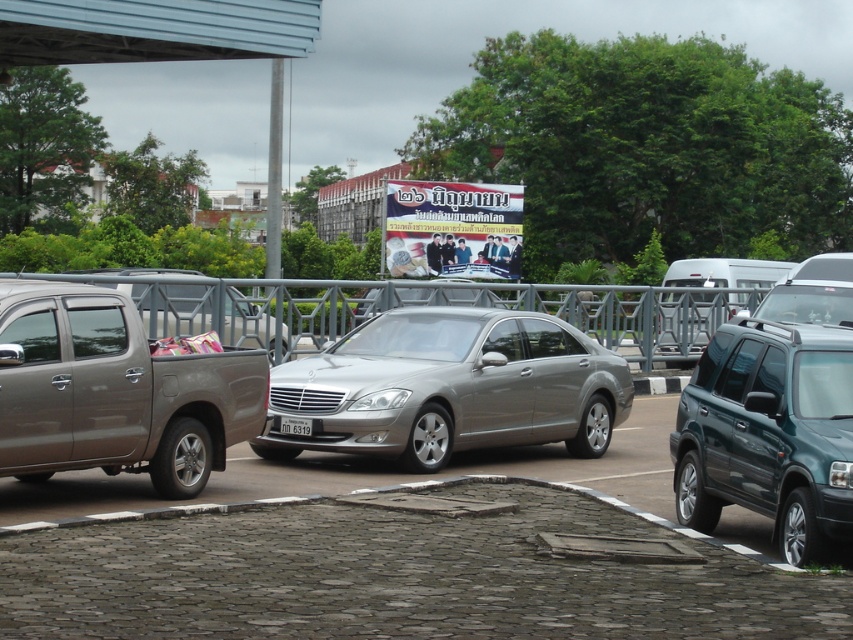
From the picture: Between satin silver sedan at center and matte metallic truck at left, which one appears on the left side from the viewer's perspective?

Positioned to the left is matte metallic truck at left.

Does satin silver sedan at center appear on the right side of matte metallic truck at left?

Correct, you'll find satin silver sedan at center to the right of matte metallic truck at left.

Between point (518, 317) and point (79, 417), which one is positioned in front?

Point (79, 417)

This screenshot has height=640, width=853. Find the location of `satin silver sedan at center`. satin silver sedan at center is located at coordinates (450, 387).

Who is lower down, satin silver sedan at center or metallic green suv at right?

metallic green suv at right is lower down.

Is the position of satin silver sedan at center less distant than that of metallic green suv at right?

No.

Where is `satin silver sedan at center`? satin silver sedan at center is located at coordinates (450, 387).

How distant is metallic green suv at right from white plastic license plate at center?

metallic green suv at right is 4.43 meters from white plastic license plate at center.

Describe the element at coordinates (769, 433) in the screenshot. I see `metallic green suv at right` at that location.

The image size is (853, 640). What do you see at coordinates (769, 433) in the screenshot?
I see `metallic green suv at right` at bounding box center [769, 433].

Locate an element on the screen. The height and width of the screenshot is (640, 853). metallic green suv at right is located at coordinates (769, 433).